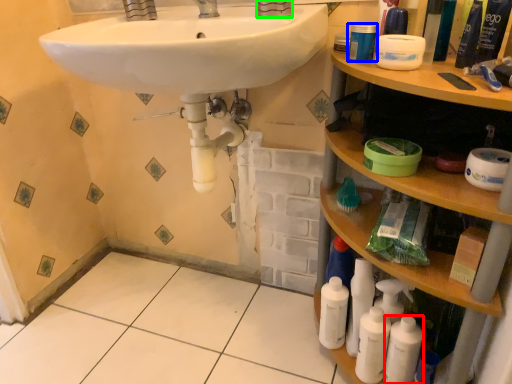
Question: Which object is positioned closest to mouthwash (highlighted by a red box)? Select from mouthwash (highlighted by a blue box) and faucet (highlighted by a green box).

Choices:
 (A) mouthwash
 (B) faucet

Answer: (A)